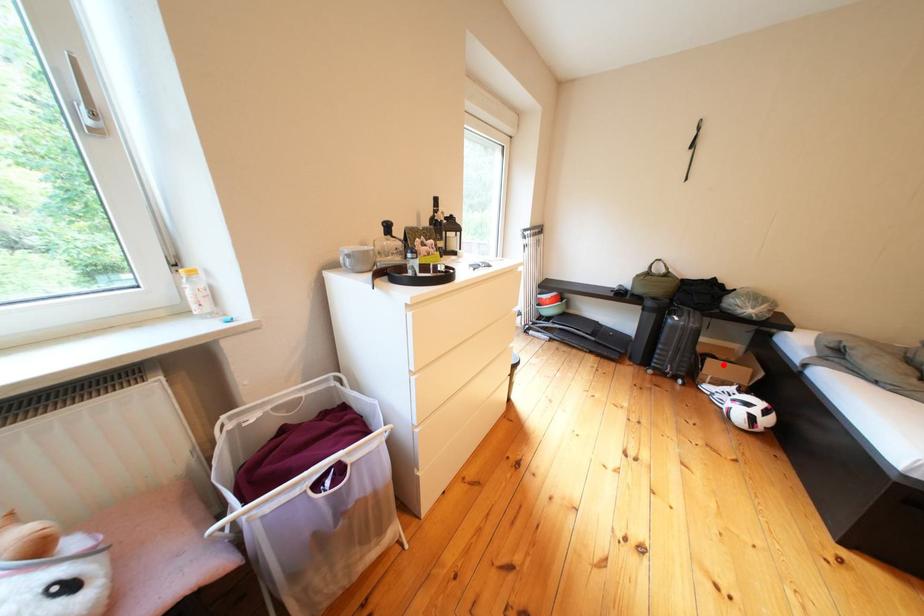
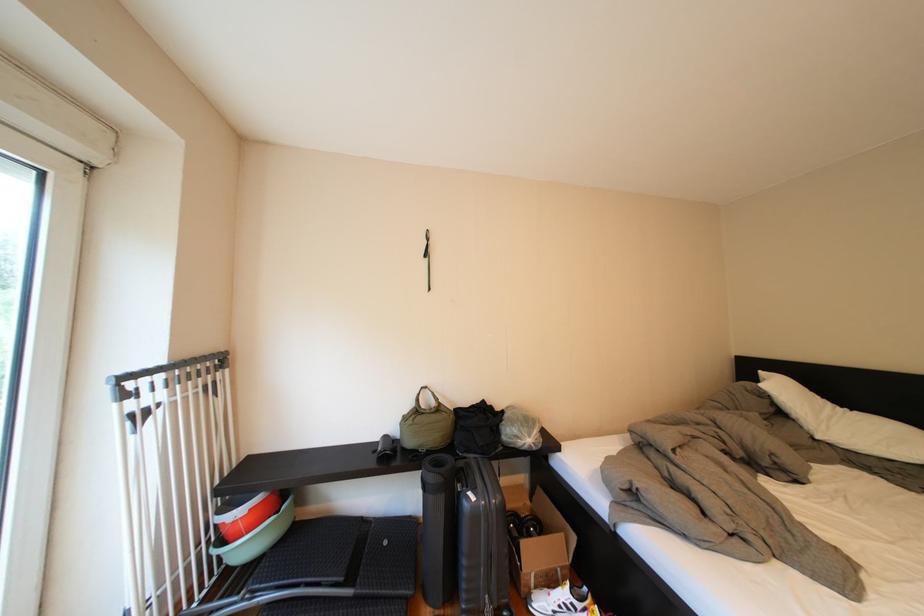
The point at the highlighted location is marked in the first image. Where is the corresponding point in the second image?

(538, 548)